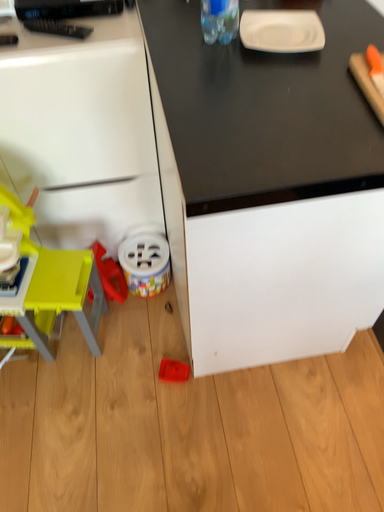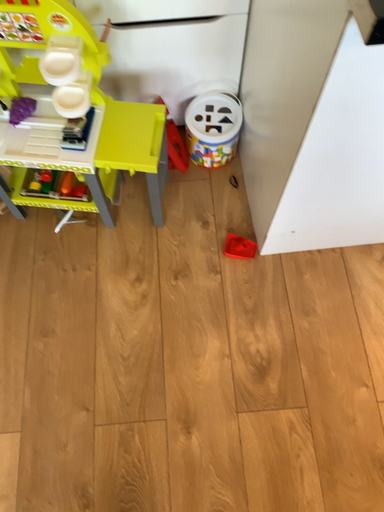
Question: Which way did the camera rotate in the video?

Choices:
 (A) rotated upward
 (B) rotated downward

Answer: (B)